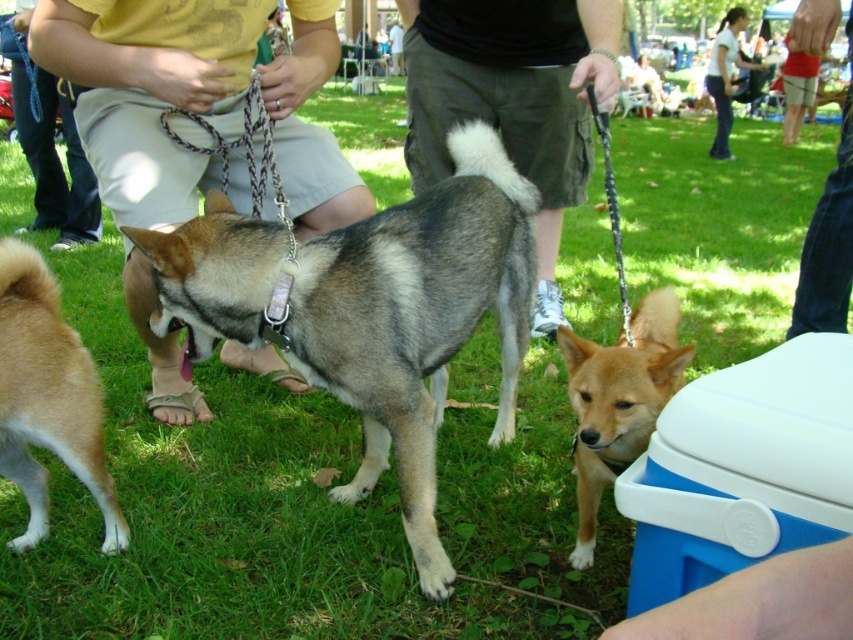
You are a photographer setting up a tripod in this park scene. You need to position your tripod so it doesn not block the view of the brown matte dog at lower right or the denim pants at lower left. Based on their positions, which object is closer to the ground and should you avoid placing the tripod near?

The brown matte dog at lower right is located below denim pants at lower left, meaning it is closer to the ground. To avoid blocking its view, position the tripod away from the area near the brown matte dog at lower right.

You are a photographer standing at the edge of the park. You want to take a photo that includes both the brown matte dog at lower right and the denim pants at lower left. Which of the two objects should you focus on first to ensure both are in clear view?

The brown matte dog at lower right is closer to the viewer than the denim pants at lower left. To ensure both are in clear view, focus on the brown matte dog at lower right first, as it is closer, and adjust the depth of field to include the denim pants at lower left in the background.